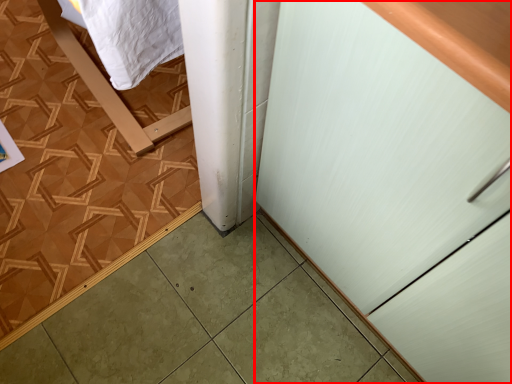
Question: From the image, what is the correct spatial relationship of cabinetry (annotated by the red box) in relation to ceramic tile?

Choices:
 (A) left
 (B) right

Answer: (B)